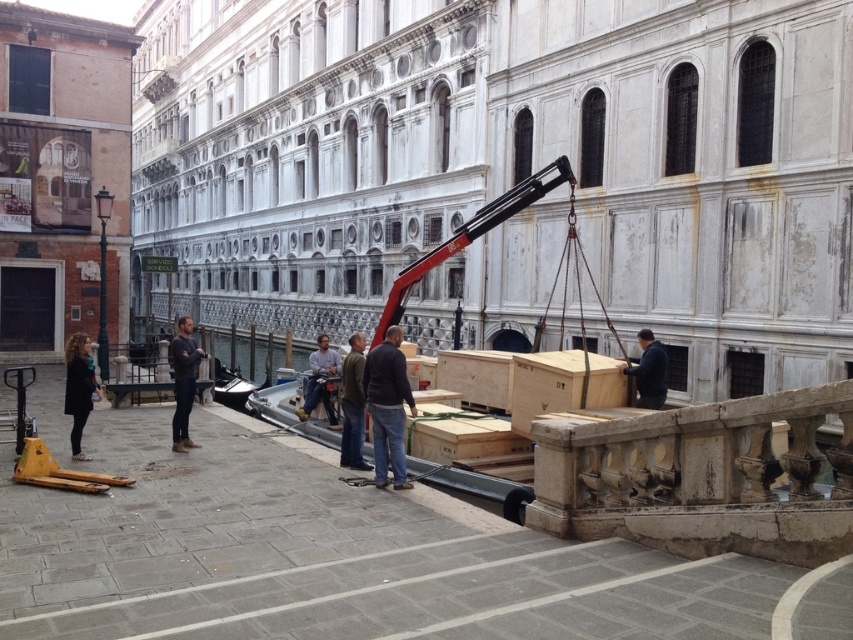
Is point (402, 365) positioned behind point (312, 372)?

No, (402, 365) is closer to viewer.

Who is positioned more to the right, dark blue sweater at center or light blue jeans at center?

dark blue sweater at center

Between point (381, 388) and point (326, 352), which one is positioned behind?

Point (326, 352)

The height and width of the screenshot is (640, 853). In order to click on dark blue sweater at center in this screenshot , I will do `click(387, 406)`.

Can you confirm if dark brown leather coat at lower left is thinner than light blue jeans at center?

In fact, dark brown leather coat at lower left might be wider than light blue jeans at center.

Is point (91, 404) farther from camera compared to point (338, 368)?

No, it is in front of (338, 368).

The height and width of the screenshot is (640, 853). I want to click on dark brown leather coat at lower left, so click(78, 388).

Is dark gray sweater at center to the right of light blue jeans at center from the viewer's perspective?

In fact, dark gray sweater at center is to the left of light blue jeans at center.

Is point (173, 365) closer to camera compared to point (326, 358)?

No.

Identify the location of dark gray sweater at center. This screenshot has width=853, height=640. (183, 381).